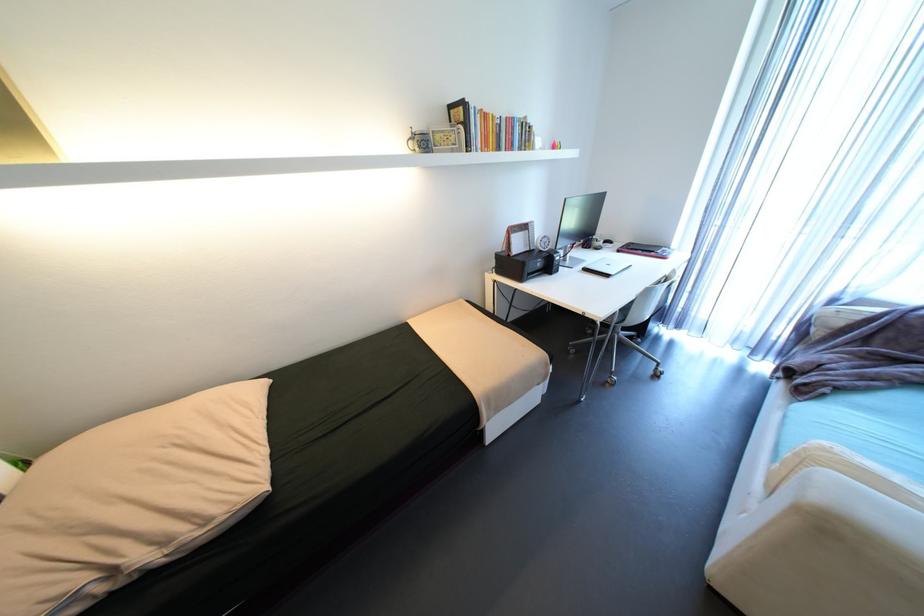
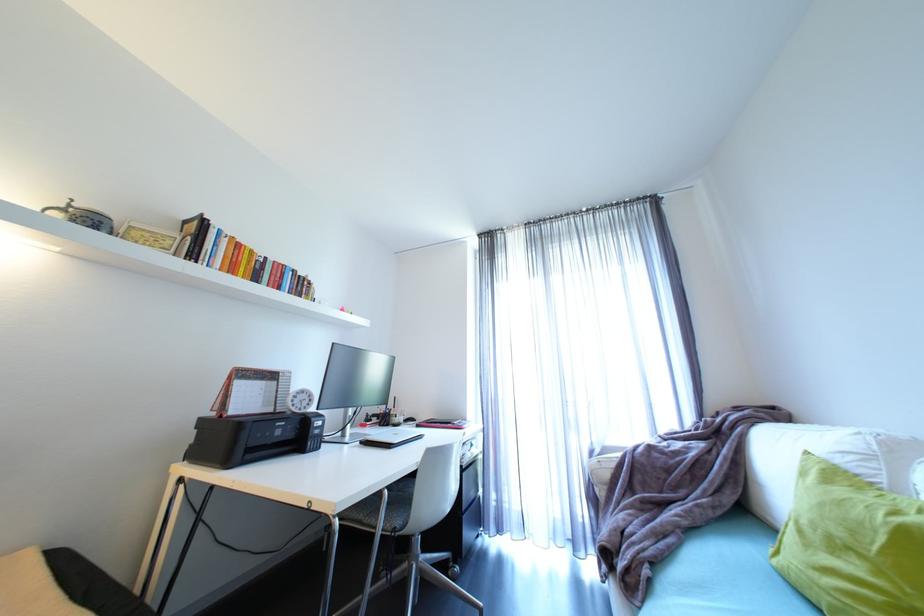
Where in the second image is the point corresponding to (516,254) from the first image?

(228, 416)